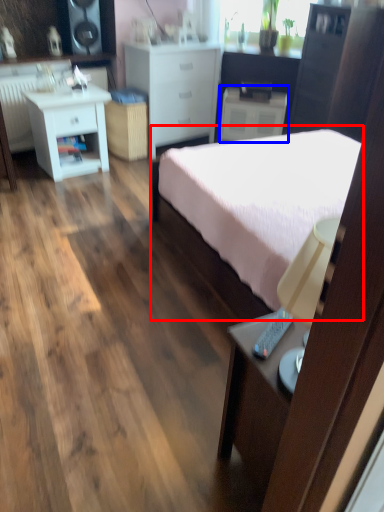
Question: Which of the following is the farthest to the observer, bed (highlighted by a red box) or nightstand (highlighted by a blue box)?

Choices:
 (A) bed
 (B) nightstand

Answer: (B)